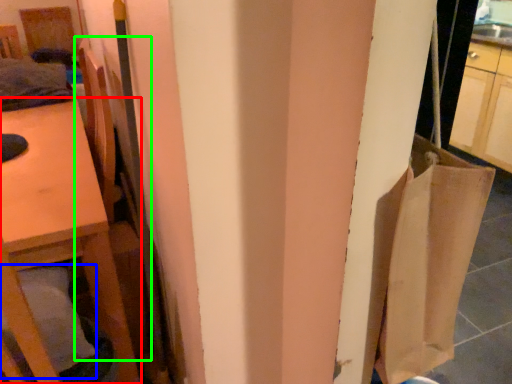
Question: Which object is the closest to the furniture (highlighted by a red box)? Choose among these: pillow (highlighted by a blue box) or chair (highlighted by a green box).

Choices:
 (A) pillow
 (B) chair

Answer: (B)